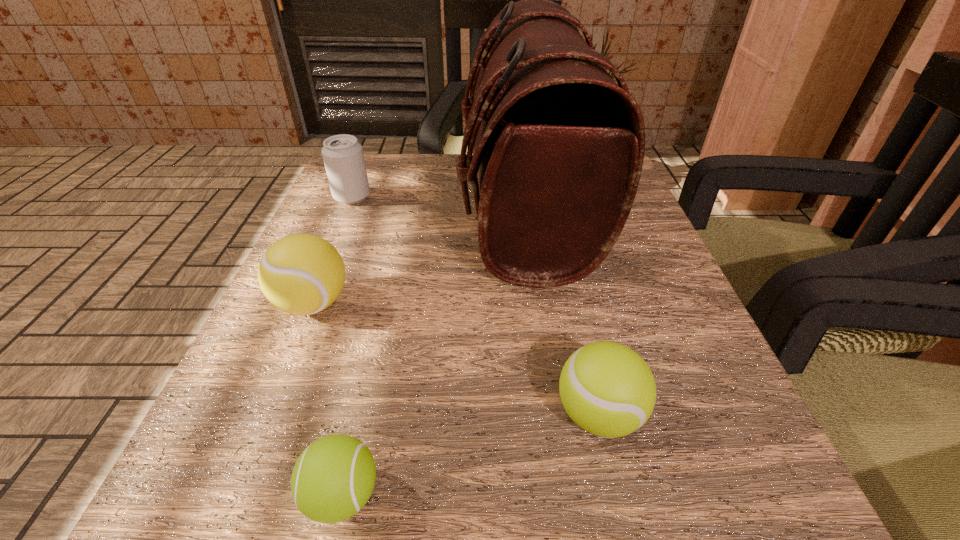
I want to click on vacant space located on the right of the can, so click(x=438, y=197).

Locate an element on the screen. The image size is (960, 540). vacant space located on the front of the farthest tennis ball is located at coordinates (290, 360).

Image resolution: width=960 pixels, height=540 pixels. I want to click on vacant space located on the right of the rightmost tennis ball, so point(733,414).

Find the location of a particular element. This screenshot has height=540, width=960. free region located 0.110m on the right of the nearest tennis ball is located at coordinates (486, 495).

You are a GUI agent. You are given a task and a screenshot of the screen. Output one action in this format:
    pyautogui.click(x=<x>, y=<y>)
    Task: Click on the satchel situated at the far edge
    The image size is (960, 540).
    Given the screenshot: What is the action you would take?
    pyautogui.click(x=558, y=146)

The width and height of the screenshot is (960, 540). Find the location of `can that is at the far edge`. can that is at the far edge is located at coordinates (343, 157).

Where is `object that is at the near edge`? object that is at the near edge is located at coordinates click(333, 478).

You are a GUI agent. You are given a task and a screenshot of the screen. Output one action in this format:
    pyautogui.click(x=<x>, y=<y>)
    Task: Click on the can that is positioned at the left edge
    
    Given the screenshot: What is the action you would take?
    pyautogui.click(x=343, y=157)

At what (x,y) coordinates should I click in order to perform the action: click on satchel located at the right edge. Please return your answer as a coordinate pair (x, y). Looking at the image, I should click on (558, 146).

Identify the location of tennis ball that is at the right edge. (607, 389).